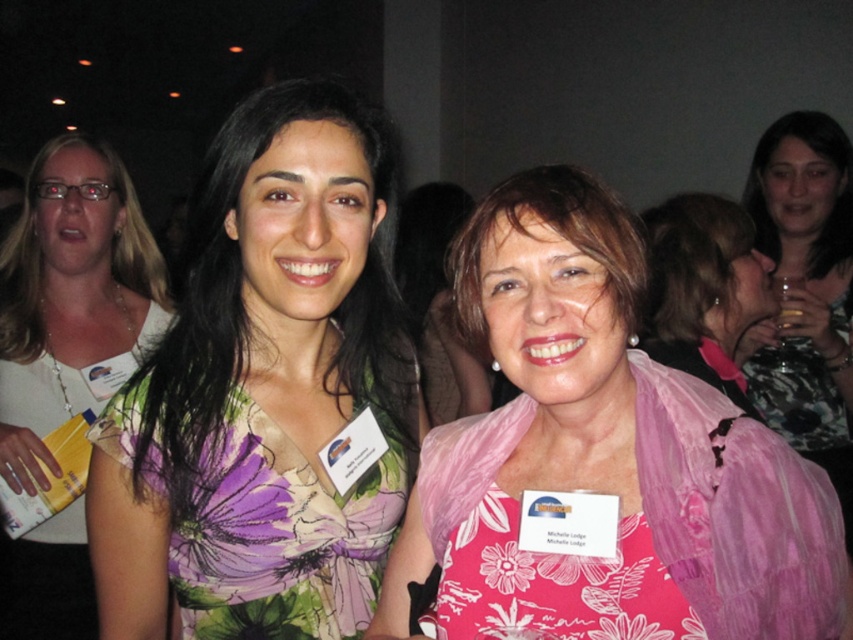
Question: Which point is closer to the camera?

Choices:
 (A) floral silk dress at center
 (B) pink satin dress at center

Answer: (A)

Question: Can you confirm if black glossy wine glass at right is smaller than pink satin dress at center?

Choices:
 (A) yes
 (B) no

Answer: (B)

Question: Among these objects, which one is nearest to the camera?

Choices:
 (A) pink floral dress at center
 (B) white glossy name tag at left
 (C) pink satin dress at center
 (D) floral silk dress at center

Answer: (A)

Question: Does pink floral dress at center have a larger size compared to black glossy wine glass at right?

Choices:
 (A) yes
 (B) no

Answer: (B)

Question: Which point appears farthest from the camera in this image?

Choices:
 (A) [x=433, y=196]
 (B) [x=786, y=362]
 (C) [x=746, y=246]

Answer: (A)

Question: Does pink floral dress at center have a greater width compared to white glossy name tag at left?

Choices:
 (A) yes
 (B) no

Answer: (B)